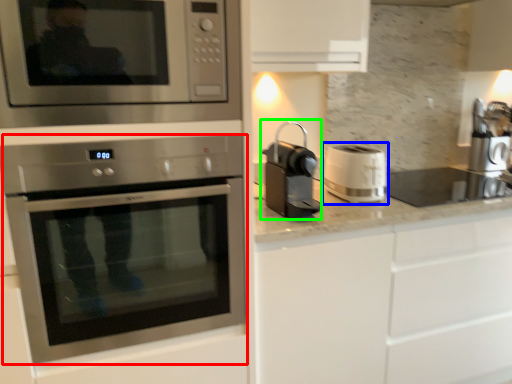
Question: Considering the real-world distances, which object is farthest from oven (highlighted by a red box)? appliance (highlighted by a blue box) or coffee machine (highlighted by a green box)?

Choices:
 (A) appliance
 (B) coffee machine

Answer: (A)